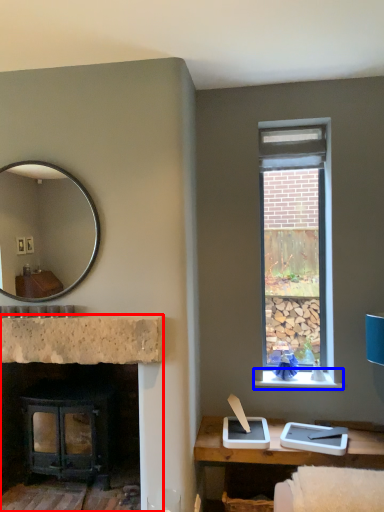
Question: Which point is closer to the camera, fireplace (highlighted by a red box) or window sill (highlighted by a blue box)?

Choices:
 (A) fireplace
 (B) window sill

Answer: (A)